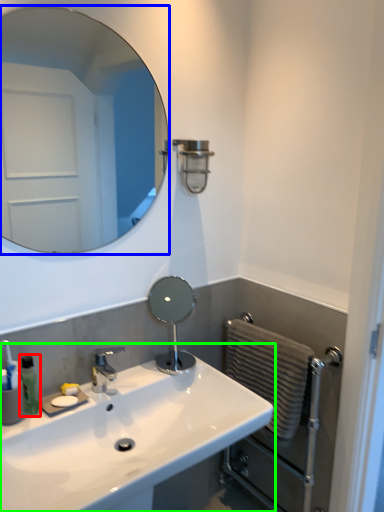
Question: Which is nearer to the soap dispenser (highlighted by a red box)? mirror (highlighted by a blue box) or sink (highlighted by a green box).

Choices:
 (A) mirror
 (B) sink

Answer: (B)